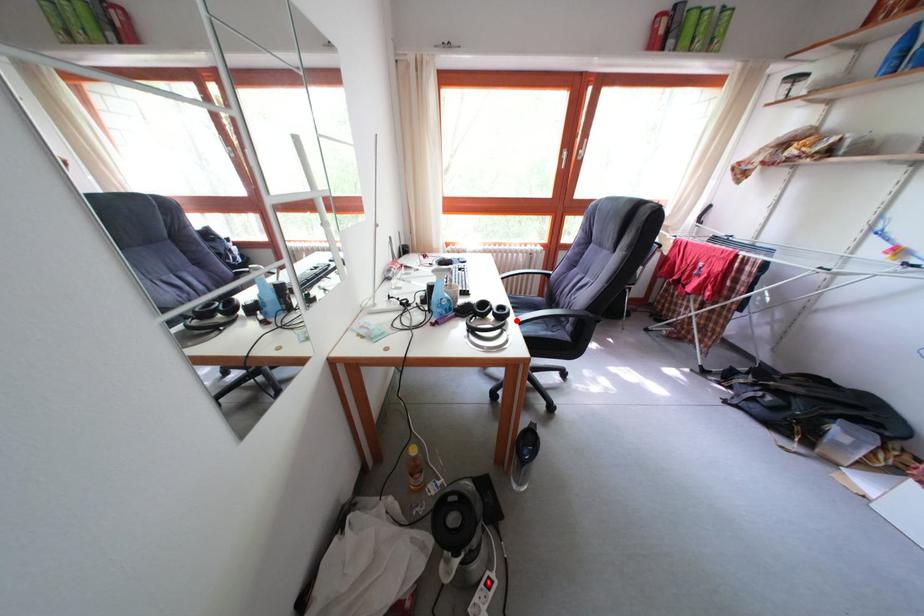
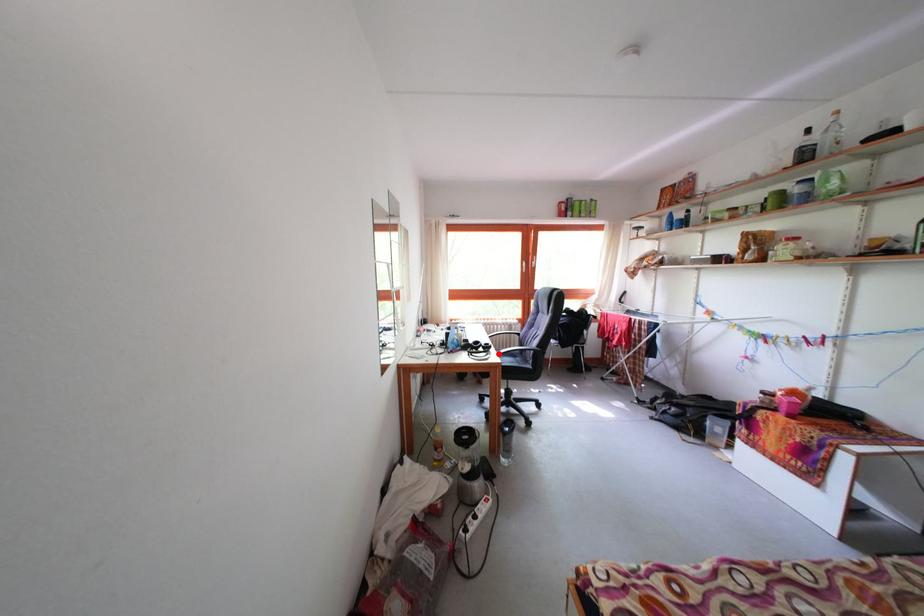
I am providing you with two images of the same scene from different viewpoints. A red point is marked on the first image and another point is marked on the second image. Do the highlighted points in image1 and image2 indicate the same real-world spot?

Yes